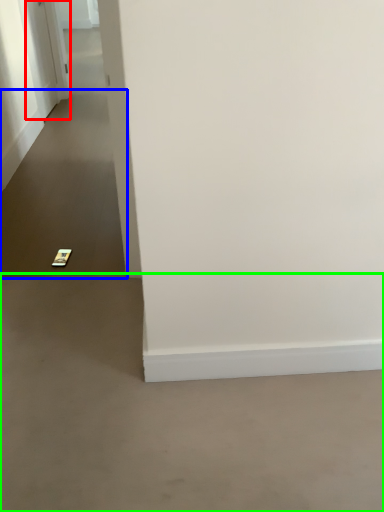
Question: Which is farther away from door (highlighted by a red box)? path (highlighted by a blue box) or concrete (highlighted by a green box)?

Choices:
 (A) path
 (B) concrete

Answer: (B)